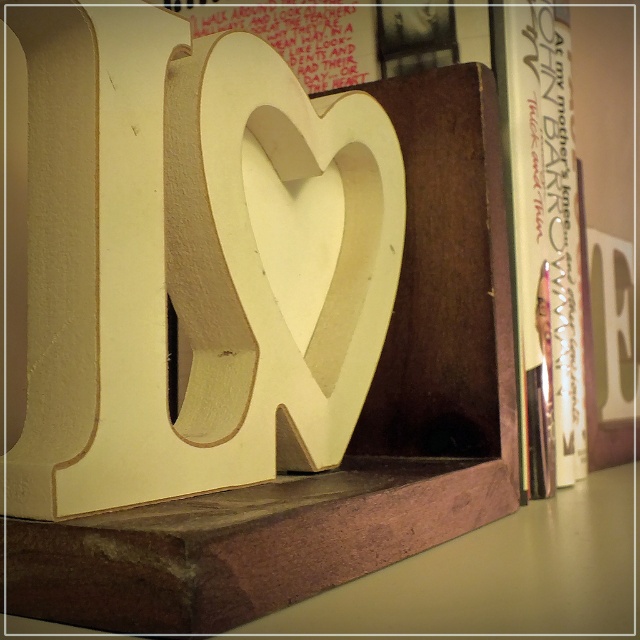
Which is below, white matte wood heart at center or white paper book at right?

Positioned lower is white matte wood heart at center.

Which is behind, point (333, 317) or point (563, 81)?

Point (563, 81)

Does point (218, 298) come farther from viewer compared to point (560, 292)?

That is False.

The width and height of the screenshot is (640, 640). Find the location of `white matte wood heart at center`. white matte wood heart at center is located at coordinates (266, 243).